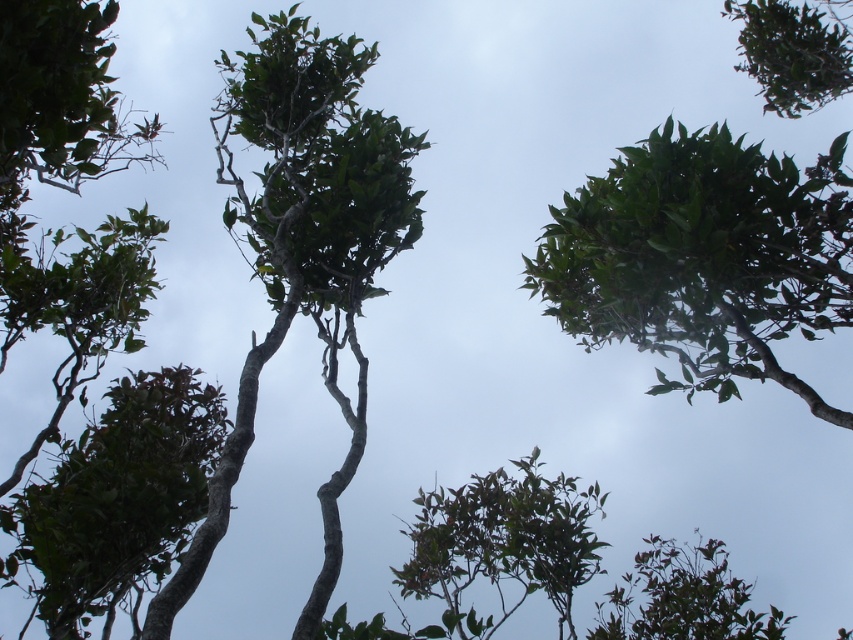
Question: Is green matte tree at upper center below green matte tree at center?

Choices:
 (A) no
 (B) yes

Answer: (A)

Question: Can you confirm if green matte tree at upper center is wider than green matte tree at center?

Choices:
 (A) yes
 (B) no

Answer: (A)

Question: Which point is closer to the camera?

Choices:
 (A) green matte tree at upper center
 (B) green matte tree at lower left
 (C) green matte tree at center

Answer: (A)

Question: Which point appears closest to the camera in this image?

Choices:
 (A) (244, 60)
 (B) (165, 525)

Answer: (B)

Question: Does green matte tree at upper center come in front of green matte tree at center?

Choices:
 (A) yes
 (B) no

Answer: (A)

Question: Which object appears farthest from the camera in this image?

Choices:
 (A) green matte tree at upper center
 (B) green matte tree at lower left

Answer: (B)